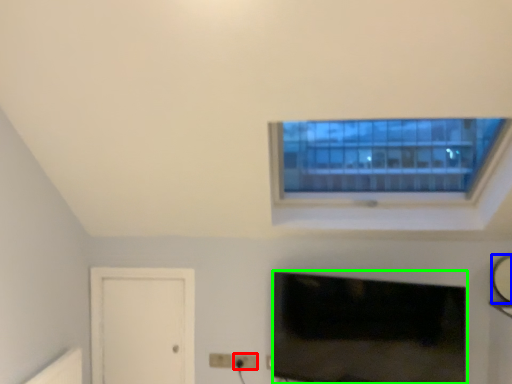
Question: Which object is the farthest from electric outlet (highlighted by a red box)? Choose among these: mirror (highlighted by a blue box) or television (highlighted by a green box).

Choices:
 (A) mirror
 (B) television

Answer: (A)